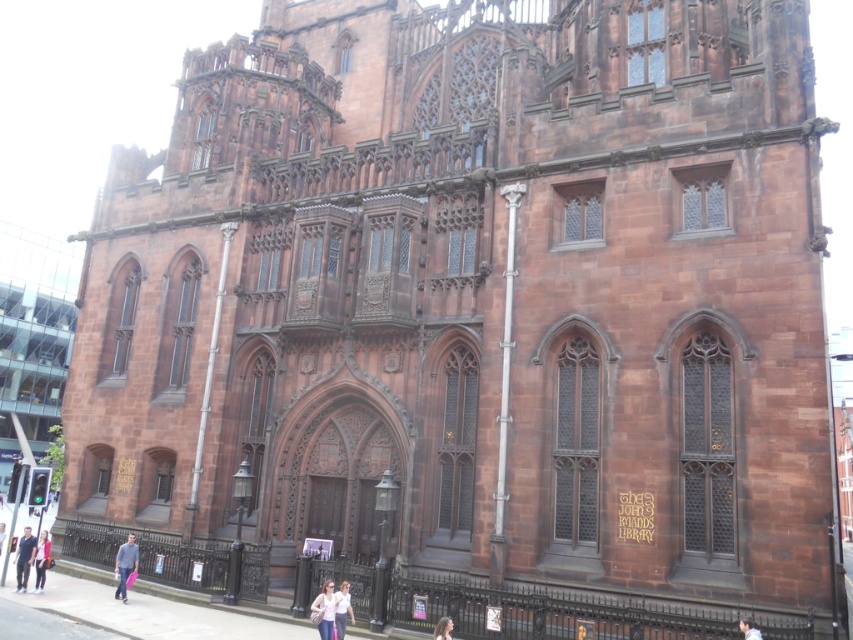
Question: Which object appears closest to the camera in this image?

Choices:
 (A) light brown hair at center
 (B) denim jacket at lower center
 (C) denim jacket at lower left

Answer: (A)

Question: Which object is the closest to the white cotton shirt at center?

Choices:
 (A) denim jacket at lower center
 (B) light brown leather jacket at center
 (C) light brown leather jacket at lower left

Answer: (A)

Question: Can you confirm if denim jacket at lower left is wider than light blue jeans at lower left?

Choices:
 (A) yes
 (B) no

Answer: (B)

Question: Which point is farther to the camera?

Choices:
 (A) white cotton shirt at center
 (B) light brown leather jacket at center
 (C) denim jacket at lower left
 (D) light blue jeans at lower left

Answer: (D)

Question: Can you confirm if denim jacket at lower left is positioned above light blue jeans at lower left?

Choices:
 (A) yes
 (B) no

Answer: (A)

Question: Can you confirm if denim jacket at lower center is bigger than light blue jeans at lower left?

Choices:
 (A) yes
 (B) no

Answer: (B)